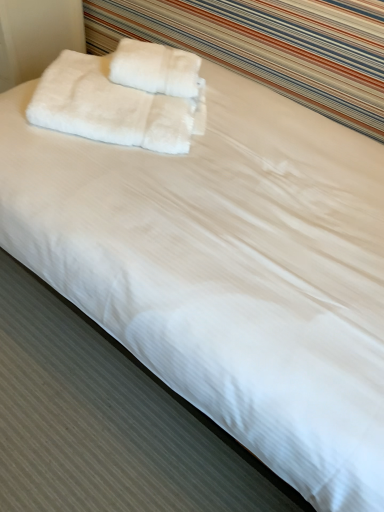
You are a GUI agent. You are given a task and a screenshot of the screen. Output one action in this format:
    pyautogui.click(x=<x>, y=<y>)
    Task: Click on the vacant space in front of white fluffy towel at upper center, the 2th towel viewed from the left
    Image resolution: width=384 pixels, height=512 pixels.
    Given the screenshot: What is the action you would take?
    pyautogui.click(x=134, y=99)